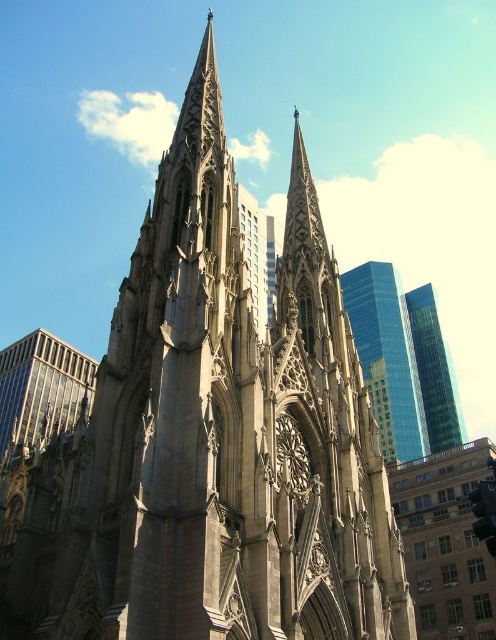
You are an architect evaluating a cityscape design. You notice the glassy reflective skyscraper at left and the green glass skyscraper at upper right. Based on their positions, which one would cast a shadow over the other during midday when the sun is directly overhead?

The glassy reflective skyscraper at left is to the left of green glass skyscraper at upper right, so during midday with the sun overhead, the glassy reflective skyscraper at left would cast a shadow to the west, while the green glass skyscraper at upper right would cast its shadow to the east. Since the glassy reflective skyscraper at left is positioned to the west of the green glass skyscraper at upper right, its shadow would extend towards the east, potentially overlapping with the green glass skyscraper.

You are standing in front of the cathedral and want to take a photo that includes both the glassy reflective skyscraper at left and the green glass skyscraper at upper right. Based on their widths, which skyscraper might require you to zoom out more to capture its full structure in the frame?

The glassy reflective skyscraper at left might be wider than the green glass skyscraper at upper right, so you might need to zoom out more to capture its full structure.

You are an architect evaluating the cathedral and its surroundings. You notice two skyscrapers in the distance. Which one, the glassy blue skyscraper at upper right or the glassy reflective skyscraper at left, is taller?

The glassy blue skyscraper at upper right is taller than the glassy reflective skyscraper at left.